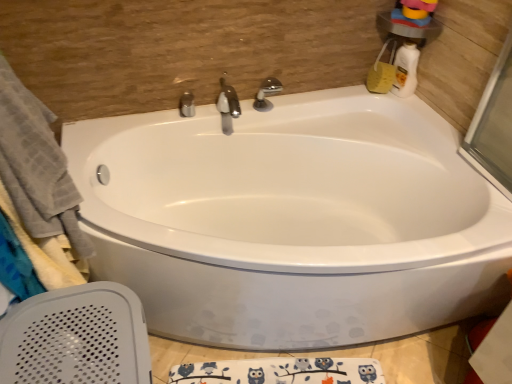
Find the location of a particular element. This screenshot has height=384, width=512. free spot to the right of polished chrome faucet at center, acting as the third tap starting from the right is located at coordinates (213, 113).